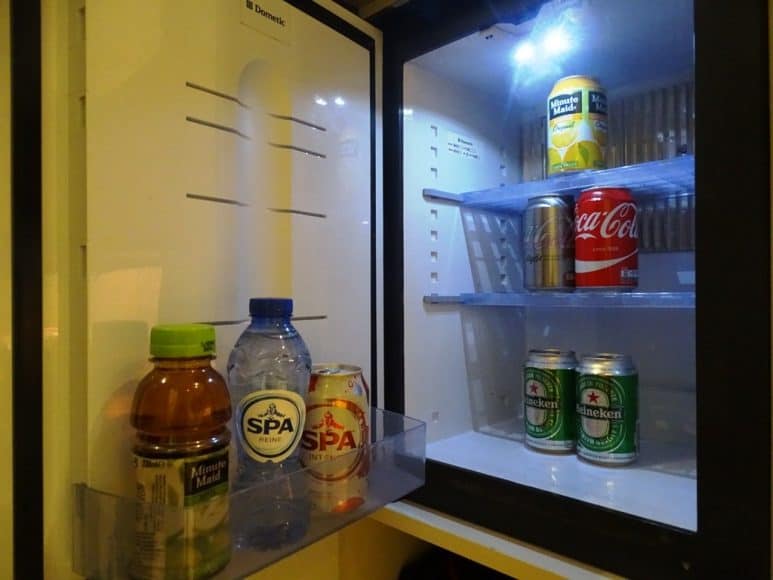
Identify the location of inside door. This screenshot has height=580, width=773. (179, 266).